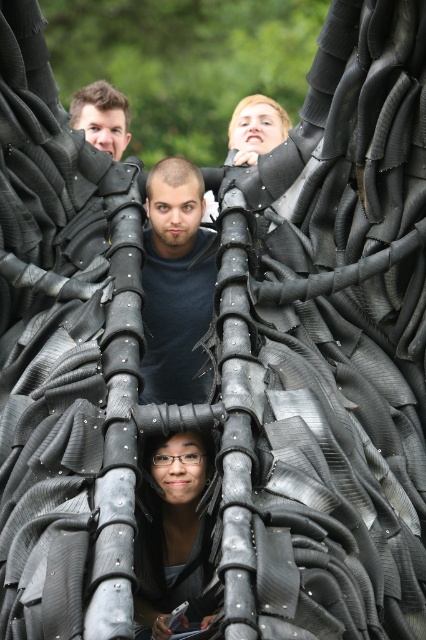
The width and height of the screenshot is (426, 640). I want to click on matte black shirt at center, so click(175, 284).

Between point (196, 280) and point (92, 129), which one is positioned in front?

Point (196, 280)

Who is more forward, (195, 323) or (100, 109)?

Positioned in front is point (195, 323).

Where is `matte black shirt at center`? The width and height of the screenshot is (426, 640). matte black shirt at center is located at coordinates (175, 284).

Who is more distant from viewer, (178,451) or (126,128)?

Point (126,128)

Can you confirm if matte black hair at center is taller than matte black face at upper left?

Correct, matte black hair at center is much taller as matte black face at upper left.

The height and width of the screenshot is (640, 426). What do you see at coordinates (173, 534) in the screenshot?
I see `matte black hair at center` at bounding box center [173, 534].

I want to click on matte black hair at center, so click(x=173, y=534).

Between point (169, 257) and point (144, 586), which one is positioned in front?

Point (144, 586)

Is matte black shirt at center below matte black hair at center?

No, matte black shirt at center is not below matte black hair at center.

Does point (143, 355) come farther from viewer compared to point (210, 566)?

Yes, point (143, 355) is behind point (210, 566).

Identify the location of matte black shirt at center. (175, 284).